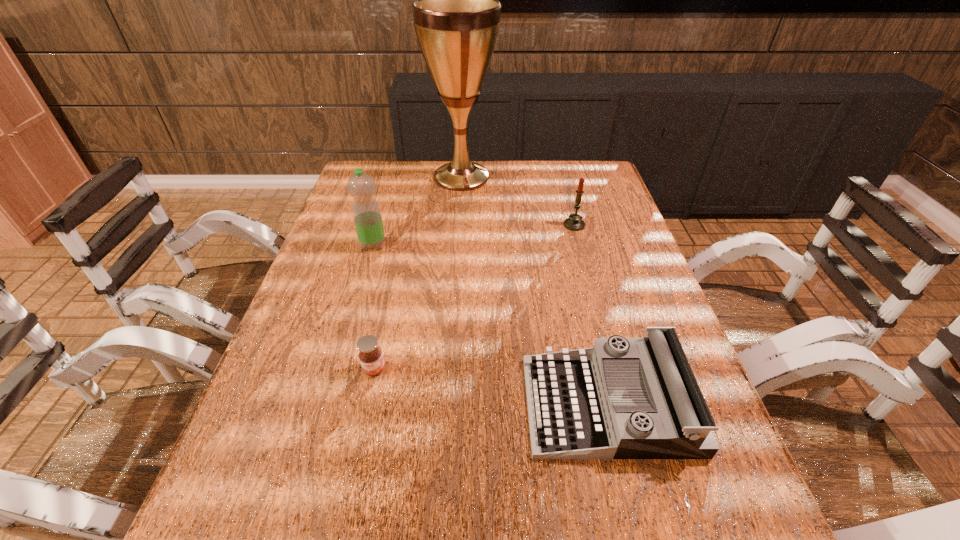
Where is `vacant space that is in between the fourth tallest object and the candle`? This screenshot has width=960, height=540. vacant space that is in between the fourth tallest object and the candle is located at coordinates (591, 315).

At what (x,y) coordinates should I click in order to perform the action: click on unoccupied position between the typewriter and the third tallest object. Please return your answer as a coordinate pair (x, y). This screenshot has width=960, height=540. Looking at the image, I should click on 591,315.

Locate an element on the screen. This screenshot has width=960, height=540. blank region between the third tallest object and the third nearest object is located at coordinates (473, 235).

This screenshot has width=960, height=540. What are the coordinates of `vacant area that lies between the fourth tallest object and the water bottle` in the screenshot? It's located at (491, 325).

Locate an element on the screen. The height and width of the screenshot is (540, 960). free space between the typewriter and the jam is located at coordinates (492, 387).

I want to click on blank region between the fourth tallest object and the second object from left to right, so click(492, 387).

Identify which object is located as the second nearest to the second shortest object. Please provide its 2D coordinates. Your answer should be formatted as a tuple, i.e. [(x, y)], where the tuple contains the x and y coordinates of a point satisfying the conditions above.

[(574, 223)]

Image resolution: width=960 pixels, height=540 pixels. Find the location of `object that can be found as the closest to the trophy cup`. object that can be found as the closest to the trophy cup is located at coordinates (574, 223).